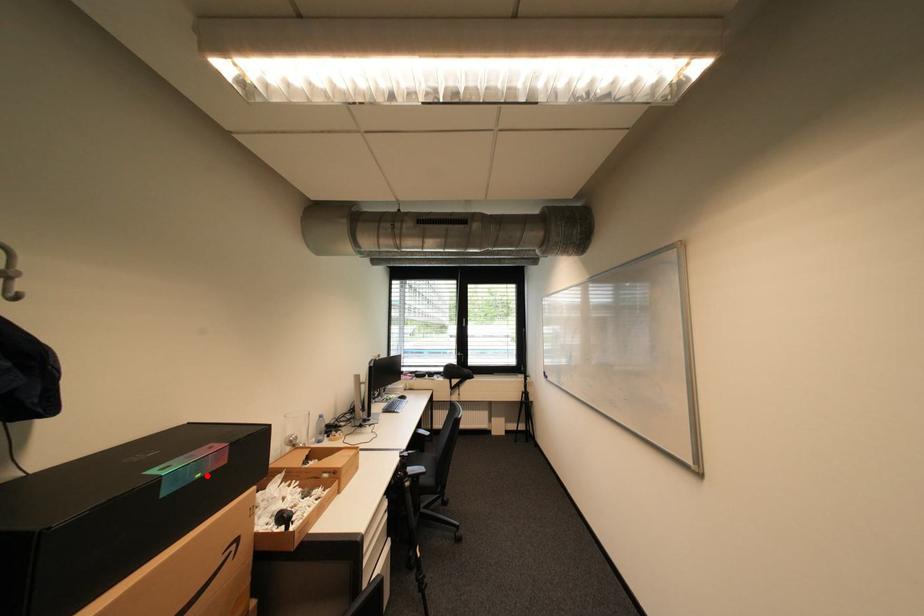
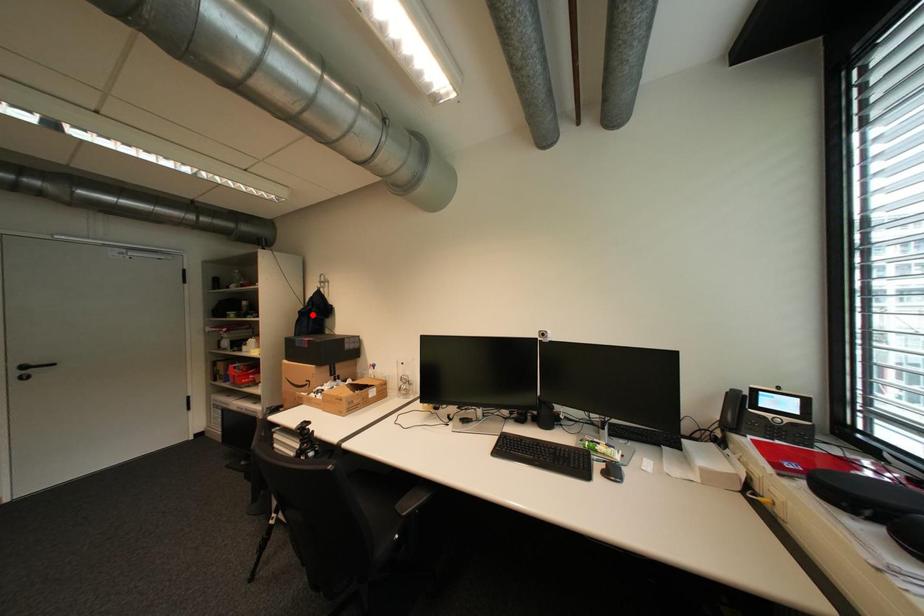
I am providing you with two images of the same scene from different viewpoints. A red point is marked on the first image and another point is marked on the second image. Do the highlighted points in image1 and image2 indicate the same real-world spot?

No